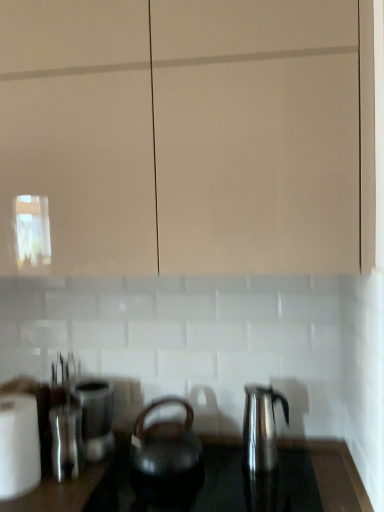
The height and width of the screenshot is (512, 384). What are the coordinates of `shiny metallic kettle at right, positioned as the second kettle in left-to-right order` in the screenshot? It's located at pyautogui.click(x=261, y=428).

Describe the element at coordinates (166, 450) in the screenshot. The height and width of the screenshot is (512, 384). I see `black matte kettle at center, the first kettle when ordered from left to right` at that location.

What do you see at coordinates (95, 416) in the screenshot? I see `satin silver canister at left, the second appliance from the front` at bounding box center [95, 416].

Locate an element on the screen. This screenshot has height=512, width=384. satin silver kettle at left, the 1th appliance when ordered from front to back is located at coordinates (66, 442).

Can you confirm if white glossy paper towel dispenser at left is smaller than satin silver canister at left, which ranks as the first appliance in back-to-front order?

Incorrect, white glossy paper towel dispenser at left is not smaller in size than satin silver canister at left, which ranks as the first appliance in back-to-front order.

Between point (27, 423) and point (100, 431), which one is positioned behind?

Positioned behind is point (100, 431).

Is white glossy paper towel dispenser at left wider than satin silver canister at left, which ranks as the first appliance in back-to-front order?

Correct, the width of white glossy paper towel dispenser at left exceeds that of satin silver canister at left, which ranks as the first appliance in back-to-front order.

The height and width of the screenshot is (512, 384). What are the coordinates of `the 2nd appliance behind the white glossy paper towel dispenser at left, starting your count from the anchor` in the screenshot? It's located at (95, 416).

Considering the relative positions of shiny metallic kettle at right, positioned as the second kettle in left-to-right order, and transparent glass cabinet at upper center in the image provided, is shiny metallic kettle at right, positioned as the second kettle in left-to-right order, to the left of transparent glass cabinet at upper center from the viewer's perspective?

Incorrect, shiny metallic kettle at right, positioned as the second kettle in left-to-right order, is not on the left side of transparent glass cabinet at upper center.

Considering the points (244, 455) and (282, 110), which point is behind, point (244, 455) or point (282, 110)?

Point (244, 455)

Which of these two, shiny metallic kettle at right, positioned as the second kettle in left-to-right order, or transparent glass cabinet at upper center, is smaller?

shiny metallic kettle at right, positioned as the second kettle in left-to-right order, is smaller.

Which object is more forward, satin silver kettle at left, the 1th appliance when ordered from front to back, or shiny black kettle at center?

shiny black kettle at center.

From the image's perspective, who appears lower, satin silver kettle at left, which is the second appliance in back-to-front order, or shiny black kettle at center?

From the image's view, shiny black kettle at center is below.

How much distance is there between satin silver kettle at left, the 1th appliance when ordered from front to back, and shiny black kettle at center?

The distance of satin silver kettle at left, the 1th appliance when ordered from front to back, from shiny black kettle at center is 20.42 inches.

Is shiny black kettle at center a part of satin silver kettle at left, the 1th appliance when ordered from front to back?

No, shiny black kettle at center is not inside satin silver kettle at left, the 1th appliance when ordered from front to back.

Between black matte kettle at center, the first kettle when ordered from left to right, and shiny metallic kettle at right, the first kettle positioned from the right, which one has less height?

black matte kettle at center, the first kettle when ordered from left to right, is shorter.

This screenshot has height=512, width=384. Find the location of `kettle that appears below the shiny metallic kettle at right, the first kettle positioned from the right (from the image's perspective)`. kettle that appears below the shiny metallic kettle at right, the first kettle positioned from the right (from the image's perspective) is located at coordinates (166, 450).

Considering the positions of objects black matte kettle at center, positioned as the 2th kettle in right-to-left order, and shiny metallic kettle at right, the first kettle positioned from the right, in the image provided, who is more to the right, black matte kettle at center, positioned as the 2th kettle in right-to-left order, or shiny metallic kettle at right, the first kettle positioned from the right,?

shiny metallic kettle at right, the first kettle positioned from the right.

From a real-world perspective, is black matte kettle at center, the first kettle when ordered from left to right, physically below shiny metallic kettle at right, the first kettle positioned from the right?

Yes, from a real-world perspective, black matte kettle at center, the first kettle when ordered from left to right, is beneath shiny metallic kettle at right, the first kettle positioned from the right.

Can we say satin silver canister at left, which ranks as the first appliance in back-to-front order, lies outside shiny metallic kettle at right, positioned as the second kettle in left-to-right order?

That's correct, satin silver canister at left, which ranks as the first appliance in back-to-front order, is outside of shiny metallic kettle at right, positioned as the second kettle in left-to-right order.

Is satin silver canister at left, the second appliance from the front, positioned far away from shiny metallic kettle at right, positioned as the second kettle in left-to-right order?

No, there isn't a large distance between satin silver canister at left, the second appliance from the front, and shiny metallic kettle at right, positioned as the second kettle in left-to-right order.

Does satin silver canister at left, the second appliance from the front, have a smaller size compared to shiny metallic kettle at right, positioned as the second kettle in left-to-right order?

Actually, satin silver canister at left, the second appliance from the front, might be larger than shiny metallic kettle at right, positioned as the second kettle in left-to-right order.

Is satin silver canister at left, the second appliance from the front, aimed at shiny metallic kettle at right, positioned as the second kettle in left-to-right order?

No.

From the image's perspective, relative to white glossy paper towel dispenser at left, is shiny black kettle at center above or below?

shiny black kettle at center is below white glossy paper towel dispenser at left.

In the image, is shiny black kettle at center positioned in front of or behind white glossy paper towel dispenser at left?

Visually, shiny black kettle at center is located in front of white glossy paper towel dispenser at left.

Is shiny black kettle at center bigger or smaller than white glossy paper towel dispenser at left?

Clearly, shiny black kettle at center is larger in size than white glossy paper towel dispenser at left.

How many degrees apart are the facing directions of shiny metallic kettle at right, positioned as the second kettle in left-to-right order, and satin silver kettle at left, which is the second appliance in back-to-front order?

20.6 degrees separate the facing orientations of shiny metallic kettle at right, positioned as the second kettle in left-to-right order, and satin silver kettle at left, which is the second appliance in back-to-front order.

Between point (261, 416) and point (76, 468), which one is positioned behind?

Positioned behind is point (76, 468).

Can you confirm if shiny metallic kettle at right, the first kettle positioned from the right, is positioned to the left of satin silver kettle at left, the 1th appliance when ordered from front to back?

No, shiny metallic kettle at right, the first kettle positioned from the right, is not to the left of satin silver kettle at left, the 1th appliance when ordered from front to back.

Which object is wider, shiny metallic kettle at right, the first kettle positioned from the right, or satin silver kettle at left, the 1th appliance when ordered from front to back?

satin silver kettle at left, the 1th appliance when ordered from front to back, is wider.

You are a GUI agent. You are given a task and a screenshot of the screen. Output one action in this format:
    pyautogui.click(x=<x>, y=<y>)
    Task: Click on the 2nd appliance to the right when counting from the white glossy paper towel dispenser at left
    
    Given the screenshot: What is the action you would take?
    (x=95, y=416)

This screenshot has height=512, width=384. What are the coordinates of `glass door above the shiny metallic kettle at right, the first kettle positioned from the right (from the image's perspective)` in the screenshot? It's located at (256, 135).

Estimate the real-world distances between objects in this image. Which object is closer to transparent glass cabinet at upper center, satin silver canister at left, the second appliance from the front, or satin silver kettle at left, which is the second appliance in back-to-front order?

satin silver canister at left, the second appliance from the front, lies closer to transparent glass cabinet at upper center than the other object.

Looking at this image, when comparing their distances from shiny black kettle at center, does transparent glass cabinet at upper center or black matte kettle at center, the first kettle when ordered from left to right, seem further?

Based on the image, transparent glass cabinet at upper center appears to be further to shiny black kettle at center.

From the image, which object appears to be farther from satin silver canister at left, the second appliance from the front, shiny black kettle at center or satin silver kettle at left, the 1th appliance when ordered from front to back?

shiny black kettle at center is positioned further to the anchor satin silver canister at left, the second appliance from the front.

Looking at this image, estimate the real-world distances between objects in this image. Which object is closer to white glossy paper towel dispenser at left, transparent glass cabinet at upper center or shiny black kettle at center?

The object closer to white glossy paper towel dispenser at left is shiny black kettle at center.

When comparing their distances from satin silver kettle at left, the 1th appliance when ordered from front to back, does shiny metallic kettle at right, the first kettle positioned from the right, or transparent glass cabinet at upper center seem closer?

shiny metallic kettle at right, the first kettle positioned from the right, lies closer to satin silver kettle at left, the 1th appliance when ordered from front to back, than the other object.

When comparing their distances from shiny metallic kettle at right, positioned as the second kettle in left-to-right order, does transparent glass cabinet at upper center or shiny black kettle at center seem further?

The object further to shiny metallic kettle at right, positioned as the second kettle in left-to-right order, is transparent glass cabinet at upper center.

From the image, which object appears to be nearer to shiny metallic kettle at right, positioned as the second kettle in left-to-right order, shiny black kettle at center or transparent glass cabinet at upper center?

shiny black kettle at center lies closer to shiny metallic kettle at right, positioned as the second kettle in left-to-right order, than the other object.

Based on their spatial positions, is satin silver kettle at left, which is the second appliance in back-to-front order, or shiny black kettle at center closer to transparent glass cabinet at upper center?

satin silver kettle at left, which is the second appliance in back-to-front order.

Find the location of a particular element. The height and width of the screenshot is (512, 384). kettle between transparent glass cabinet at upper center and black matte kettle at center, the first kettle when ordered from left to right, in the vertical direction is located at coordinates (261, 428).

You are a GUI agent. You are given a task and a screenshot of the screen. Output one action in this format:
    pyautogui.click(x=<x>, y=<y>)
    Task: Click on the counter top between black matte kettle at center, the first kettle when ordered from left to right, and shiny metallic kettle at right, the first kettle positioned from the right, from left to right
    The width and height of the screenshot is (384, 512).
    Given the screenshot: What is the action you would take?
    click(x=333, y=474)

The height and width of the screenshot is (512, 384). In order to click on kitchen appliance between transparent glass cabinet at upper center and satin silver kettle at left, which is the second appliance in back-to-front order, in the up-down direction in this screenshot , I will do `click(19, 445)`.

Identify the location of counter top between satin silver canister at left, which ranks as the first appliance in back-to-front order, and shiny metallic kettle at right, positioned as the second kettle in left-to-right order, in the horizontal direction. (333, 474).